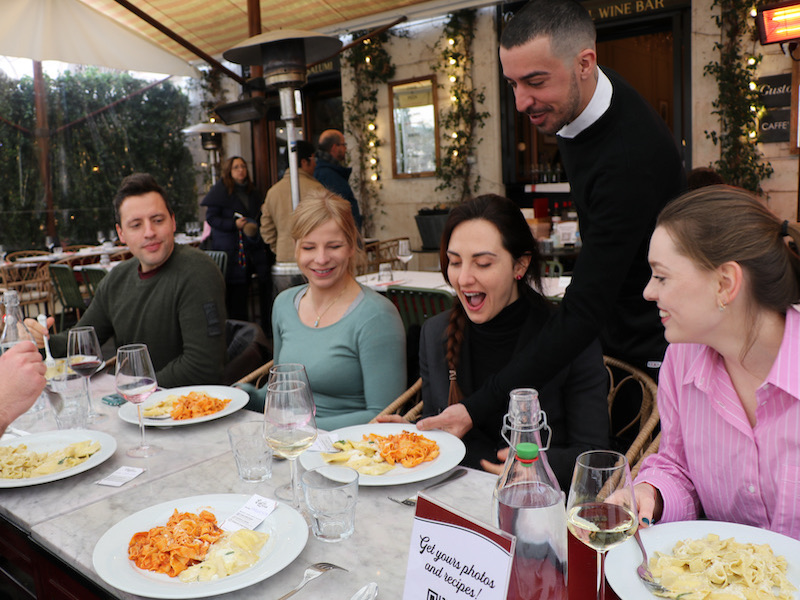
Find the location of `clear water glasses`. clear water glasses is located at coordinates (82, 407), (338, 509), (246, 454).